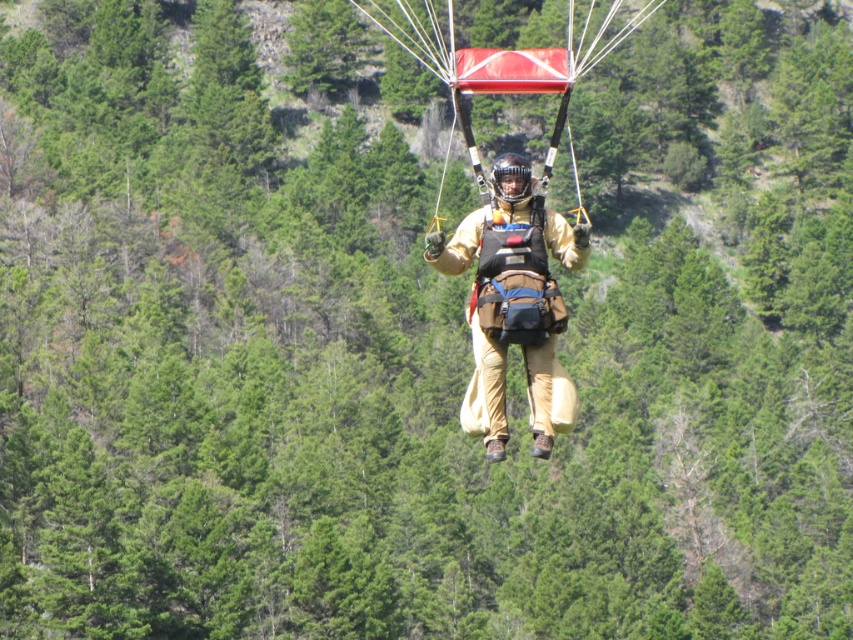
Question: Does tan fabric parachute at center appear over red fabric parachute at center?

Choices:
 (A) yes
 (B) no

Answer: (B)

Question: Among these points, which one is nearest to the camera?

Choices:
 (A) (479, 49)
 (B) (543, 268)

Answer: (B)

Question: Does tan fabric parachute at center have a smaller size compared to red fabric parachute at center?

Choices:
 (A) no
 (B) yes

Answer: (B)

Question: Does tan fabric parachute at center appear over red fabric parachute at center?

Choices:
 (A) yes
 (B) no

Answer: (B)